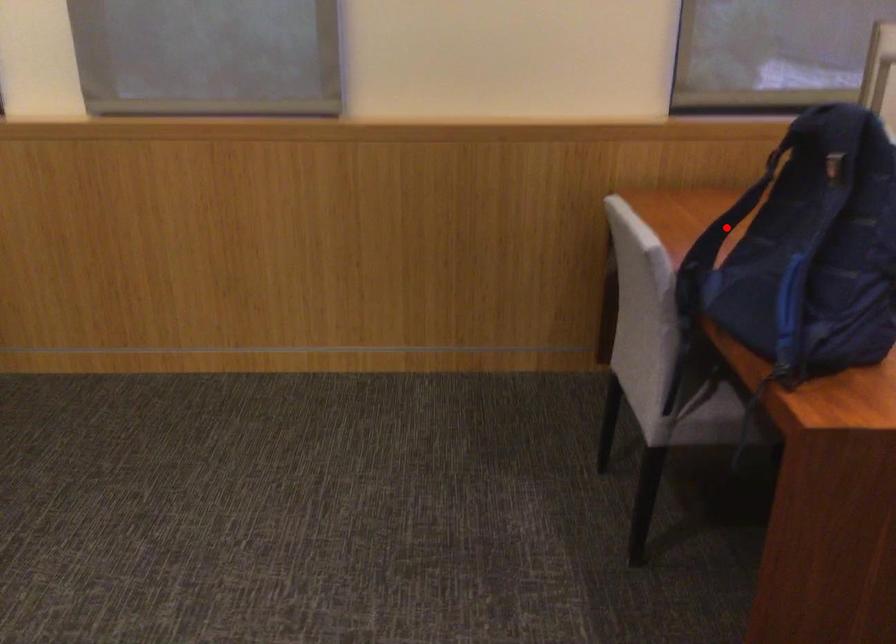
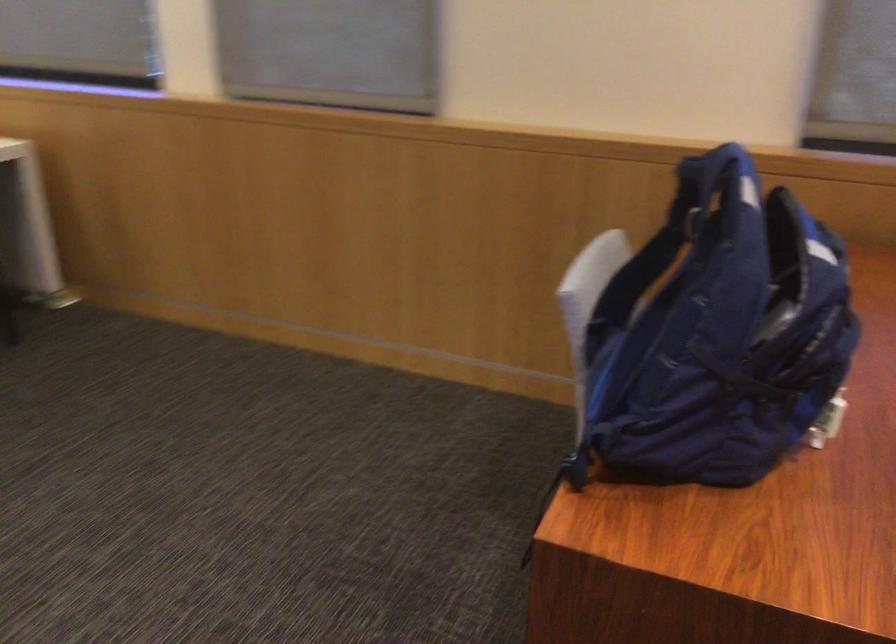
Locate, in the second image, the point that corresponds to the highlighted location in the first image.

(645, 285)